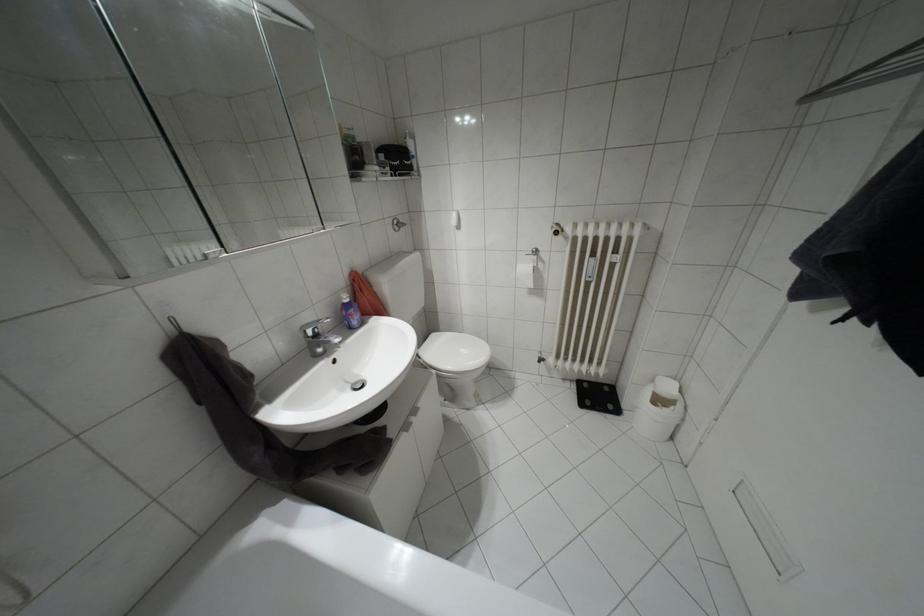
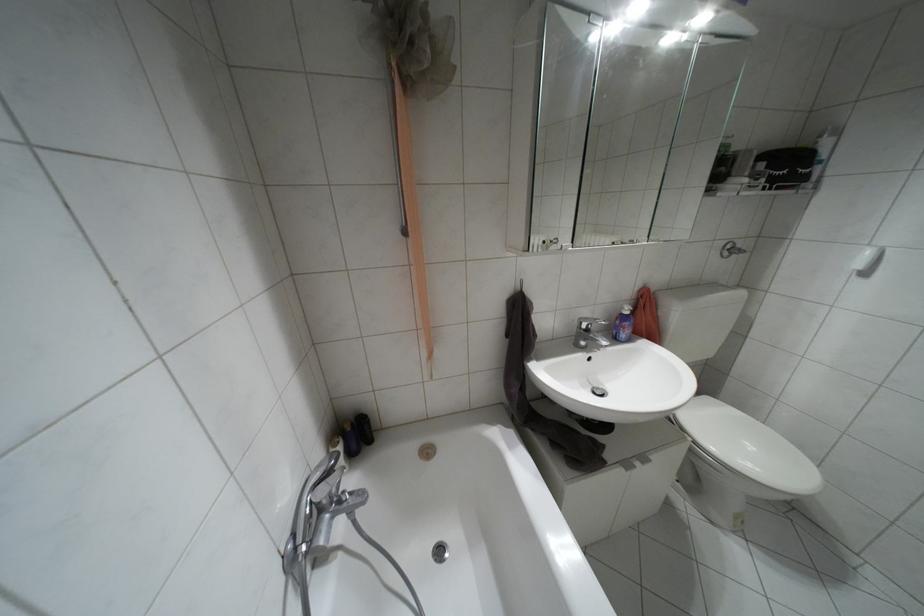
The point at (346, 300) is marked in the first image. Where is the corresponding point in the second image?

(626, 312)